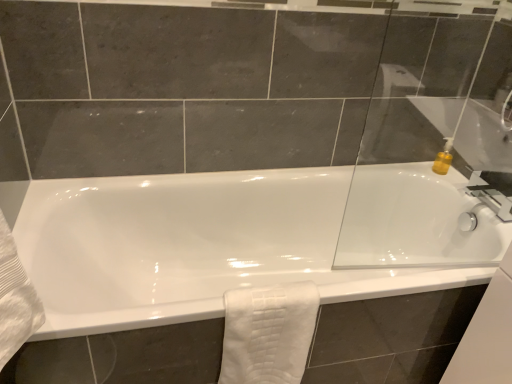
I want to click on transparent glass door at upper right, so click(x=435, y=146).

Find the location of a particular element. This screenshot has height=384, width=512. transparent glass door at upper right is located at coordinates (435, 146).

Considering the sizes of objects transparent glass door at upper right and white textured towel at lower center in the image provided, who is shorter, transparent glass door at upper right or white textured towel at lower center?

Standing shorter between the two is white textured towel at lower center.

Considering the relative sizes of transparent glass door at upper right and white textured towel at lower center in the image provided, is transparent glass door at upper right smaller than white textured towel at lower center?

Correct, transparent glass door at upper right occupies less space than white textured towel at lower center.

Is transparent glass door at upper right far from white textured towel at lower center?

No, transparent glass door at upper right is in close proximity to white textured towel at lower center.

Relative to white textured towel at lower center, is transparent glass door at upper right in front or behind?

transparent glass door at upper right is in front of white textured towel at lower center.

Which is closer, (306, 302) or (402, 165)?

Point (306, 302) is closer to the camera than point (402, 165).

Considering the relative sizes of white textured towel at lower center and transparent glass door at upper right in the image provided, is white textured towel at lower center smaller than transparent glass door at upper right?

Incorrect, white textured towel at lower center is not smaller in size than transparent glass door at upper right.

Considering the sizes of white textured towel at lower center and transparent glass door at upper right in the image, is white textured towel at lower center wider or thinner than transparent glass door at upper right?

Clearly, white textured towel at lower center has more width compared to transparent glass door at upper right.

Would you say white textured towel at lower center is to the left or to the right of transparent glass door at upper right in the picture?

white textured towel at lower center is to the left of transparent glass door at upper right.

Is white glossy bathtub at center not inside white textured towel at lower center?

white glossy bathtub at center lies outside white textured towel at lower center's area.

Is white glossy bathtub at center beside white textured towel at lower center?

No, white glossy bathtub at center is not next to white textured towel at lower center.

Is point (422, 206) more distant than point (270, 288)?

That is True.

Which of these two, white glossy bathtub at center or white textured towel at lower center, is wider?

white glossy bathtub at center.

From their relative heights in the image, would you say white textured towel at lower center is taller or shorter than white glossy bathtub at center?

white textured towel at lower center is shorter than white glossy bathtub at center.

Is white textured towel at lower center smaller than white glossy bathtub at center?

Yes.

Between white textured towel at lower center and white glossy bathtub at center, which one has larger width?

white glossy bathtub at center.

From a real-world perspective, is white textured towel at lower center physically located above or below white glossy bathtub at center?

white textured towel at lower center is above white glossy bathtub at center.

Who is taller, transparent glass door at upper right or white glossy bathtub at center?

Standing taller between the two is transparent glass door at upper right.

From a real-world perspective, between transparent glass door at upper right and white glossy bathtub at center, who is vertically lower?

white glossy bathtub at center.

Is point (410, 55) more distant than point (316, 172)?

No, it is not.

Consider the image. Is transparent glass door at upper right aimed at white glossy bathtub at center?

No, transparent glass door at upper right is not oriented towards white glossy bathtub at center.

Is white glossy bathtub at center positioned with its back to transparent glass door at upper right?

No, white glossy bathtub at center is not facing away from transparent glass door at upper right.

Is white glossy bathtub at center beside transparent glass door at upper right?

white glossy bathtub at center and transparent glass door at upper right are clearly separated.

Is white glossy bathtub at center wider than transparent glass door at upper right?

Indeed, white glossy bathtub at center has a greater width compared to transparent glass door at upper right.

Considering the relative sizes of white glossy bathtub at center and transparent glass door at upper right in the image provided, is white glossy bathtub at center taller than transparent glass door at upper right?

In fact, white glossy bathtub at center may be shorter than transparent glass door at upper right.

This screenshot has width=512, height=384. I want to click on glass door that is above the white textured towel at lower center (from the image's perspective), so tap(435, 146).

Find the location of `glass door in front of the white textured towel at lower center`. glass door in front of the white textured towel at lower center is located at coordinates (435, 146).

Considering their positions, is transparent glass door at upper right positioned closer to white glossy bathtub at center than white textured towel at lower center?

Among the two, transparent glass door at upper right is located nearer to white glossy bathtub at center.

Considering their positions, is white textured towel at lower center positioned closer to white glossy bathtub at center than transparent glass door at upper right?

transparent glass door at upper right is positioned closer to the anchor white glossy bathtub at center.

Considering their positions, is white glossy bathtub at center positioned closer to white textured towel at lower center than transparent glass door at upper right?

white glossy bathtub at center lies closer to white textured towel at lower center than the other object.

Based on their spatial positions, is transparent glass door at upper right or white glossy bathtub at center further from white textured towel at lower center?

Among the two, transparent glass door at upper right is located further to white textured towel at lower center.

From the image, which object appears to be nearer to transparent glass door at upper right, white glossy bathtub at center or white textured towel at lower center?

Based on the image, white glossy bathtub at center appears to be nearer to transparent glass door at upper right.

Estimate the real-world distances between objects in this image. Which object is closer to transparent glass door at upper right, white textured towel at lower center or white glossy bathtub at center?

white glossy bathtub at center lies closer to transparent glass door at upper right than the other object.

Identify the location of bathtub between white textured towel at lower center and transparent glass door at upper right. (193, 246).